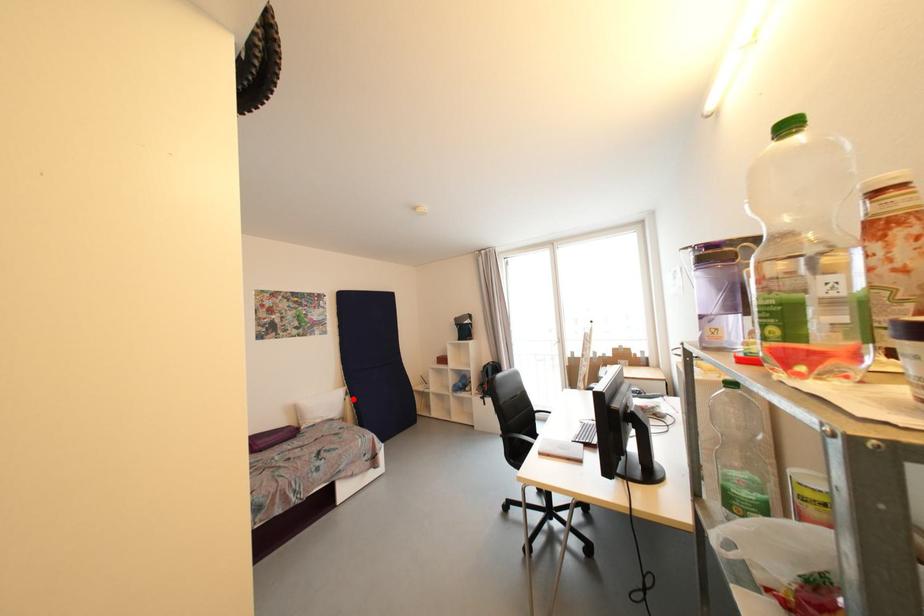
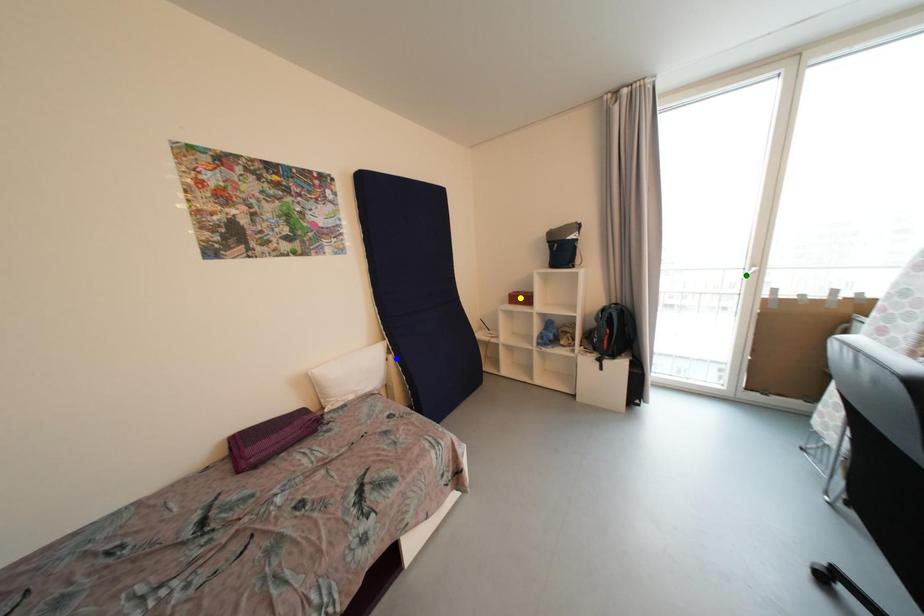
Question: I am providing you with two images of the same scene from different viewpoints. A red point is marked on the first image. You are given multiple points on the second image. Which point in image 2 is actually the same real-world point as the red point in image 1?

Choices:
 (A) blue point
 (B) green point
 (C) yellow point

Answer: (A)